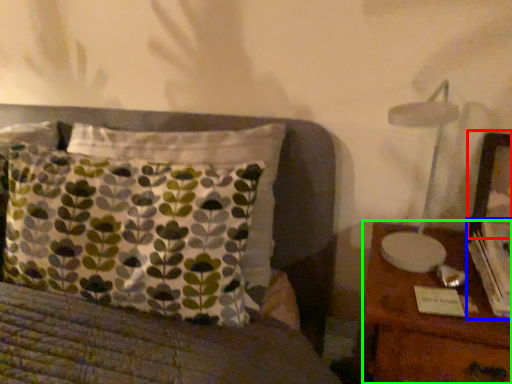
Question: Which is farther away from picture frame (highlighted by a red box)? book (highlighted by a blue box) or nightstand (highlighted by a green box)?

Choices:
 (A) book
 (B) nightstand

Answer: (B)